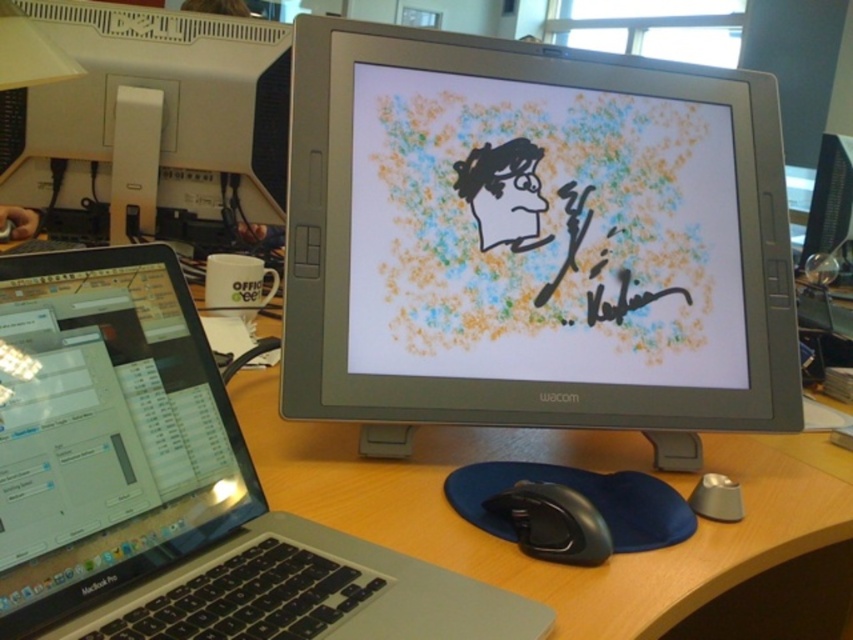
You are setting up a new workspace and want to place a 12 inch wide notebook between the slate gray monitor at center and the sleek silver laptop at left. Can the notebook fit between them based on their widths?

The slate gray monitor at center has a larger width than the sleek silver laptop at left. Therefore, the 12 inch wide notebook may not fit between them unless the distance between the two devices is sufficient. However, the description only provides information about their widths, not the distance between them. Without knowing the actual spacing between the monitor and laptop, it is impossible to determine if the notebook will fit.

You need to place a wireless charger on the desk between the sleek silver laptop at left and the matte black monitor at upper right. Based on their positions, where should you place the charger so it is equidistant from both devices?

The sleek silver laptop at left is located below the matte black monitor at upper right. To place the wireless charger equidistant from both, position it along the vertical midpoint between them. Since the laptop is lower and the monitor is higher, the charger should be halfway up the vertical space between their positions.